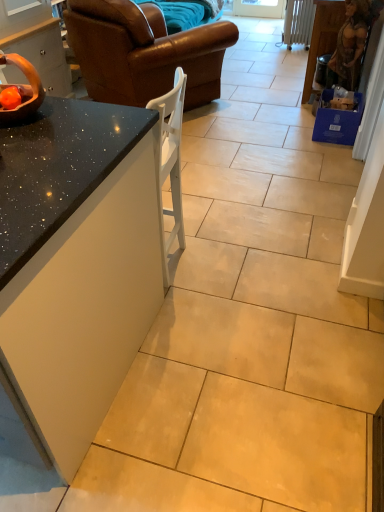
You are a GUI agent. You are given a task and a screenshot of the screen. Output one action in this format:
    pyautogui.click(x=<x>, y=<y>)
    Task: Click on the unoccupied region to the right of brown leather couch at upper left
    
    Given the screenshot: What is the action you would take?
    pyautogui.click(x=261, y=101)